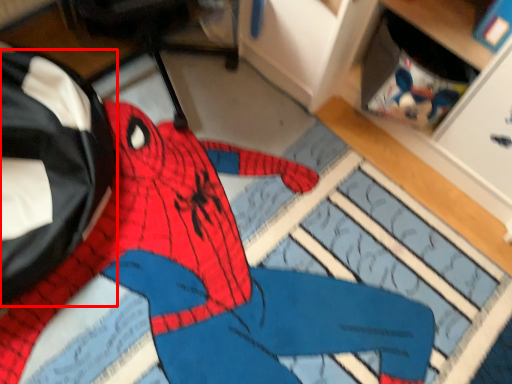
Question: From the image's perspective, where is messenger bag (annotated by the red box) located in relation to person in the image?

Choices:
 (A) below
 (B) above

Answer: (B)